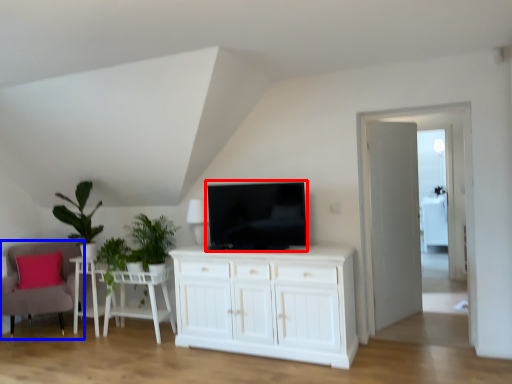
Question: Which of the following is the farthest to the observer, television (highlighted by a red box) or chair (highlighted by a blue box)?

Choices:
 (A) television
 (B) chair

Answer: (B)